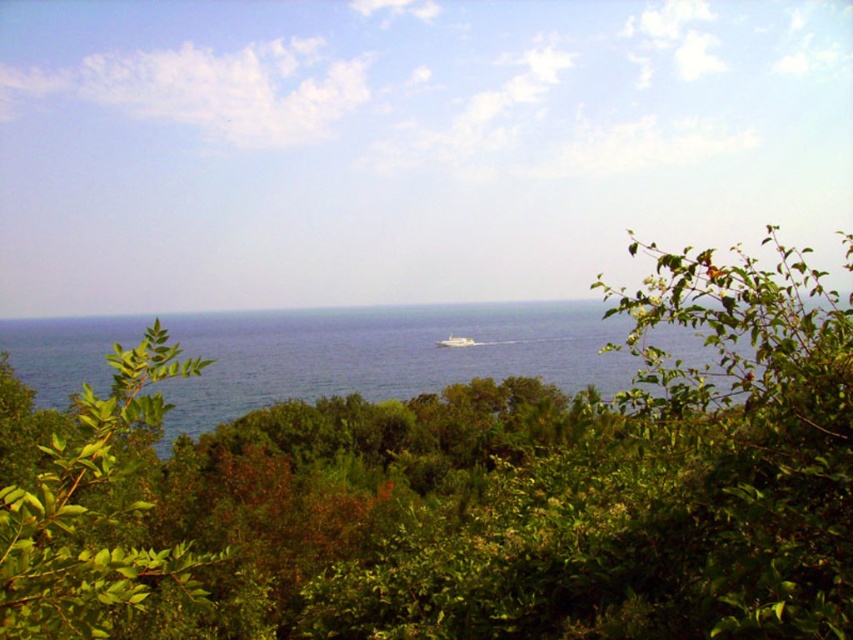
You are a photographer trying to capture the white glossy boat at center in your shot. You notice the blue water at center is blocking part of the boat. How can you adjust your position to ensure the boat is fully visible?

The blue water at center is taller than the white glossy boat at center, so you should lower your camera angle or move to a lower position to ensure the boat is fully visible without obstruction from the water.